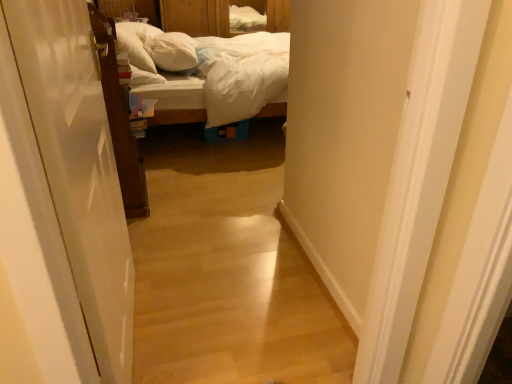
Question: Should I look upward or downward to see white glossy door at left, positioned as the first door in front-to-back order?

Choices:
 (A) up
 (B) down

Answer: (B)

Question: Considering the relative sizes of white glossy door at left, which is the 1th door from right to left, and white soft pillow at center, placed as the first pillow when sorted from right to left, in the image provided, is white glossy door at left, which is the 1th door from right to left, smaller than white soft pillow at center, placed as the first pillow when sorted from right to left,?

Choices:
 (A) yes
 (B) no

Answer: (B)

Question: Is white glossy door at left, which ranks as the second door in left-to-right order, far away from white soft pillow at center, which is counted as the second pillow, starting from the left?

Choices:
 (A) yes
 (B) no

Answer: (A)

Question: From the image's perspective, does white glossy door at left, positioned as the first door in front-to-back order, appear lower than white soft pillow at center, placed as the first pillow when sorted from right to left?

Choices:
 (A) no
 (B) yes

Answer: (B)

Question: Is white glossy door at left, which is counted as the 2th door, starting from the back, closer to the viewer compared to white soft pillow at center, placed as the first pillow when sorted from right to left?

Choices:
 (A) yes
 (B) no

Answer: (A)

Question: Is white glossy door at left, positioned as the first door in front-to-back order, thinner than white soft pillow at center, which is counted as the second pillow, starting from the left?

Choices:
 (A) yes
 (B) no

Answer: (A)

Question: Can you see white glossy door at left, which is the 1th door from right to left, touching white soft pillow at center, placed as the first pillow when sorted from right to left?

Choices:
 (A) no
 (B) yes

Answer: (A)

Question: Does wooden bed at center turn towards brown wooden door at left, which ranks as the first door in back-to-front order?

Choices:
 (A) no
 (B) yes

Answer: (A)

Question: Can you confirm if wooden bed at center is smaller than brown wooden door at left, the second door from the right?

Choices:
 (A) no
 (B) yes

Answer: (A)

Question: Is wooden bed at center taller than brown wooden door at left, which ranks as the first door in back-to-front order?

Choices:
 (A) yes
 (B) no

Answer: (B)

Question: Is wooden bed at center thinner than brown wooden door at left, which ranks as the 1th door in left-to-right order?

Choices:
 (A) yes
 (B) no

Answer: (B)

Question: Does wooden bed at center touch brown wooden door at left, which ranks as the 1th door in left-to-right order?

Choices:
 (A) yes
 (B) no

Answer: (B)

Question: From the image's perspective, is wooden bed at center below brown wooden door at left, which ranks as the 1th door in left-to-right order?

Choices:
 (A) yes
 (B) no

Answer: (B)

Question: Does white soft pillow at upper left, the first pillow viewed from the left, have a lesser width compared to wooden bed at center?

Choices:
 (A) no
 (B) yes

Answer: (B)